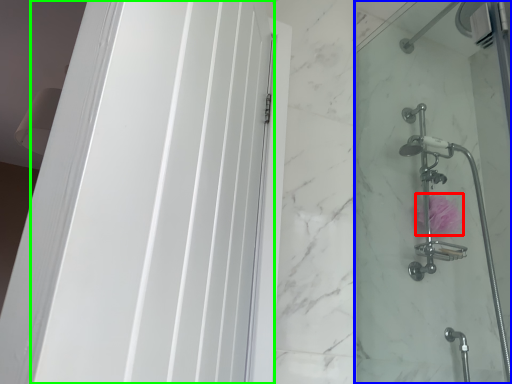
Question: Considering the real-world distances, which object is farthest from flower (highlighted by a red box)? shower door (highlighted by a blue box) or screen door (highlighted by a green box)?

Choices:
 (A) shower door
 (B) screen door

Answer: (B)